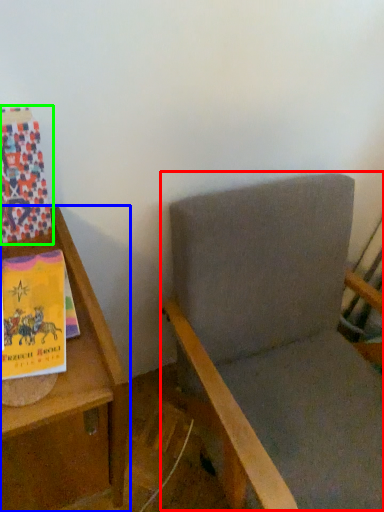
Question: Considering the real-world distances, which object is farthest from rocking chair (highlighted by a red box)? furniture (highlighted by a blue box) or paperback book (highlighted by a green box)?

Choices:
 (A) furniture
 (B) paperback book

Answer: (B)